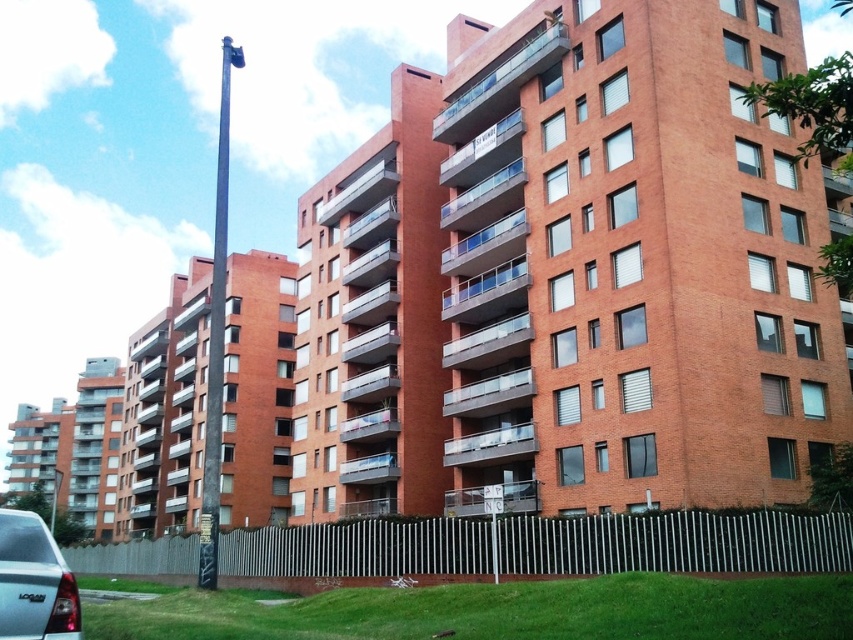
Question: Is matte black car at lower left thinner than black metal pole at center?

Choices:
 (A) no
 (B) yes

Answer: (B)

Question: Among these objects, which one is farthest from the camera?

Choices:
 (A) black metal pole at center
 (B) matte black car at lower left

Answer: (A)

Question: Which object appears farthest from the camera in this image?

Choices:
 (A) matte black car at lower left
 (B) black metal pole at center

Answer: (B)

Question: Which of the following is the farthest from the observer?

Choices:
 (A) (219, 308)
 (B) (54, 544)

Answer: (A)

Question: Considering the relative positions of matte black car at lower left and black metal pole at center in the image provided, where is matte black car at lower left located with respect to black metal pole at center?

Choices:
 (A) above
 (B) below

Answer: (B)

Question: Is matte black car at lower left to the right of black metal pole at center from the viewer's perspective?

Choices:
 (A) no
 (B) yes

Answer: (B)